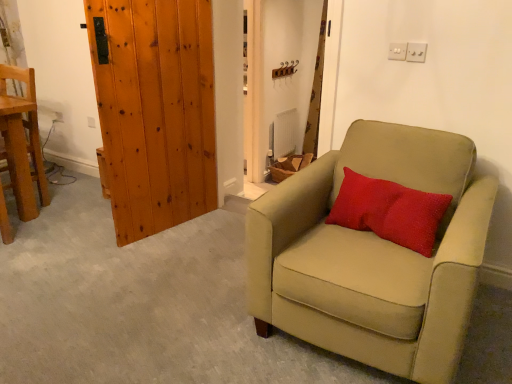
You are a GUI agent. You are given a task and a screenshot of the screen. Output one action in this format:
    pyautogui.click(x=<x>, y=<y>)
    Task: Click on the vacant region to the right of wooden chair at left, the second chair when ordered from front to back
    Image resolution: width=512 pixels, height=384 pixels.
    Given the screenshot: What is the action you would take?
    pyautogui.click(x=70, y=199)